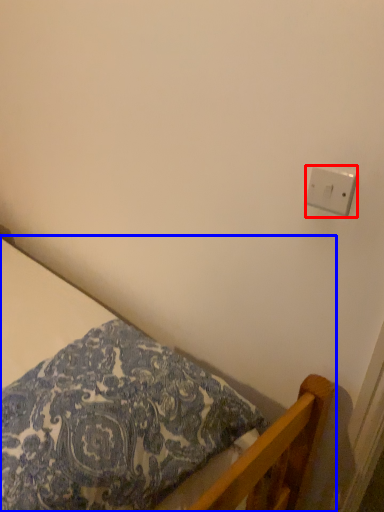
Question: Which object appears farthest to the camera in this image, light switch (highlighted by a red box) or bed (highlighted by a blue box)?

Choices:
 (A) light switch
 (B) bed

Answer: (A)